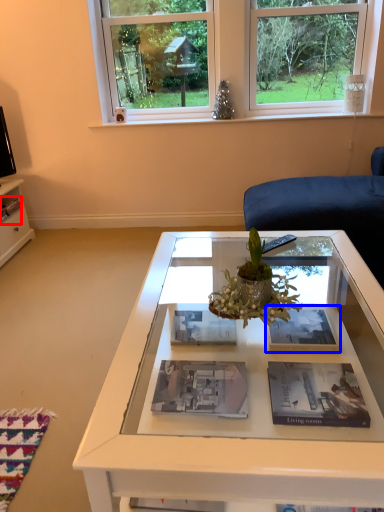
Question: Which object is closer to the camera taking this photo, magazine (highlighted by a red box) or magazine (highlighted by a blue box)?

Choices:
 (A) magazine
 (B) magazine

Answer: (B)